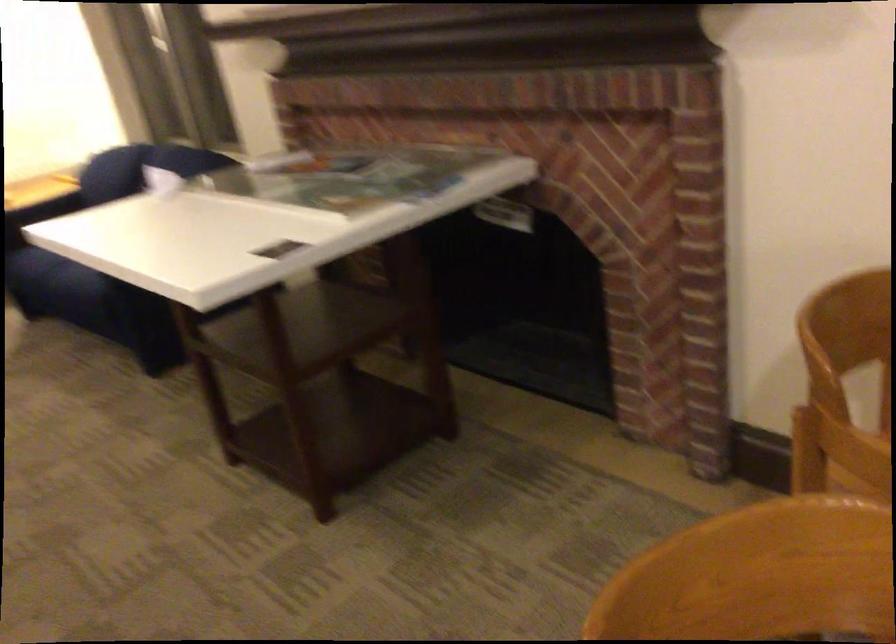
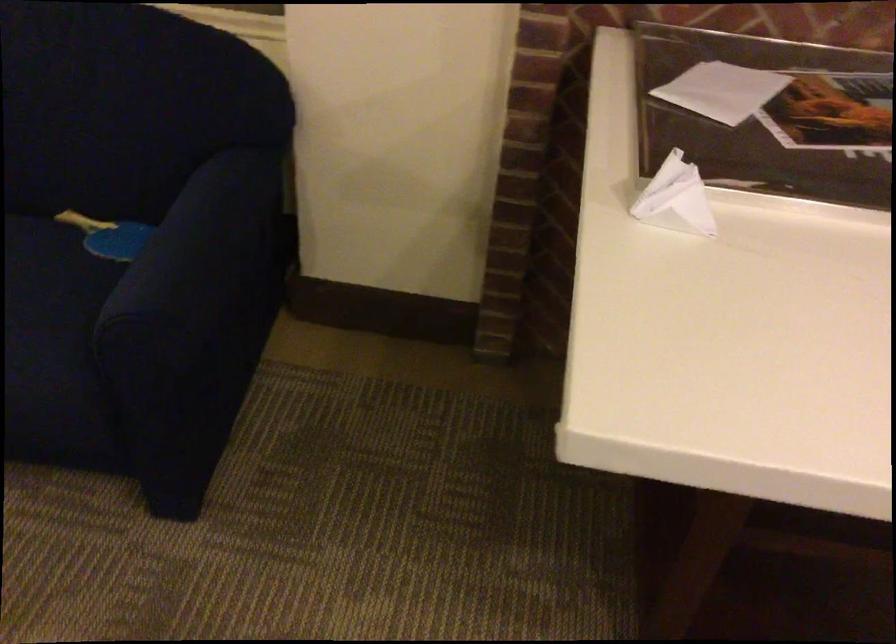
The point at (150, 167) is marked in the first image. Where is the corresponding point in the second image?

(675, 199)